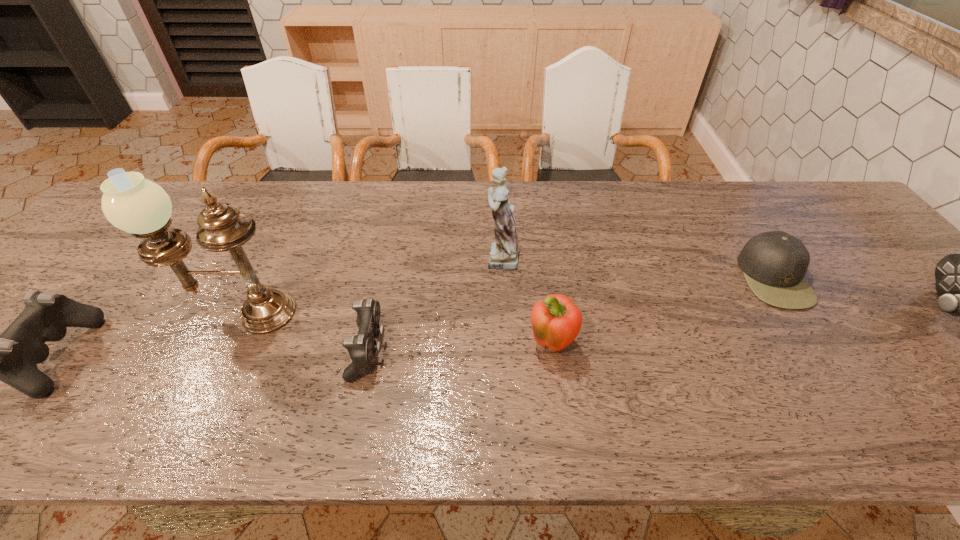
Locate an element on the screen. The image size is (960, 540). the third shortest object is located at coordinates (11, 357).

Locate an element on the screen. the leftmost object is located at coordinates (11, 357).

Where is `the second control from right to left`? The image size is (960, 540). the second control from right to left is located at coordinates (361, 348).

The height and width of the screenshot is (540, 960). Identify the location of the shortest control. (361, 348).

Where is `the second tallest object`? The width and height of the screenshot is (960, 540). the second tallest object is located at coordinates (504, 254).

At what (x,y) coordinates should I click in order to perform the action: click on cap. Please return your answer as a coordinate pair (x, y). Looking at the image, I should click on (774, 263).

Where is `oil lamp`? This screenshot has height=540, width=960. oil lamp is located at coordinates (136, 205).

At what (x,y) coordinates should I click in order to perform the action: click on the tallest object. Please return your answer as a coordinate pair (x, y). Looking at the image, I should click on (136, 205).

Locate an element on the screen. the fourth shortest object is located at coordinates (556, 321).

The height and width of the screenshot is (540, 960). Find the location of `vacant point located on the surface of the leftmost control with buttons`. vacant point located on the surface of the leftmost control with buttons is located at coordinates (8, 356).